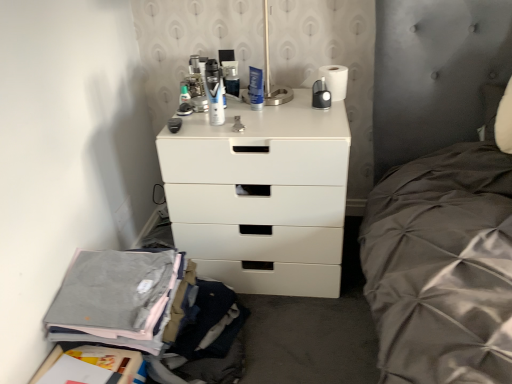
Locate an element on the screen. This screenshot has width=512, height=384. free spot to the left of matte black shaving cream can at center, acting as the 3th toiletry starting from the back is located at coordinates (186, 125).